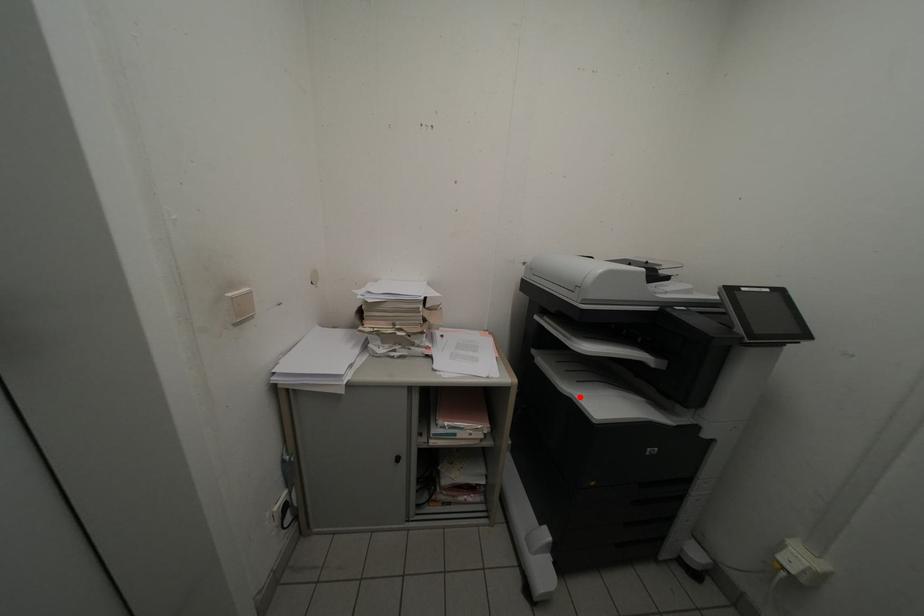
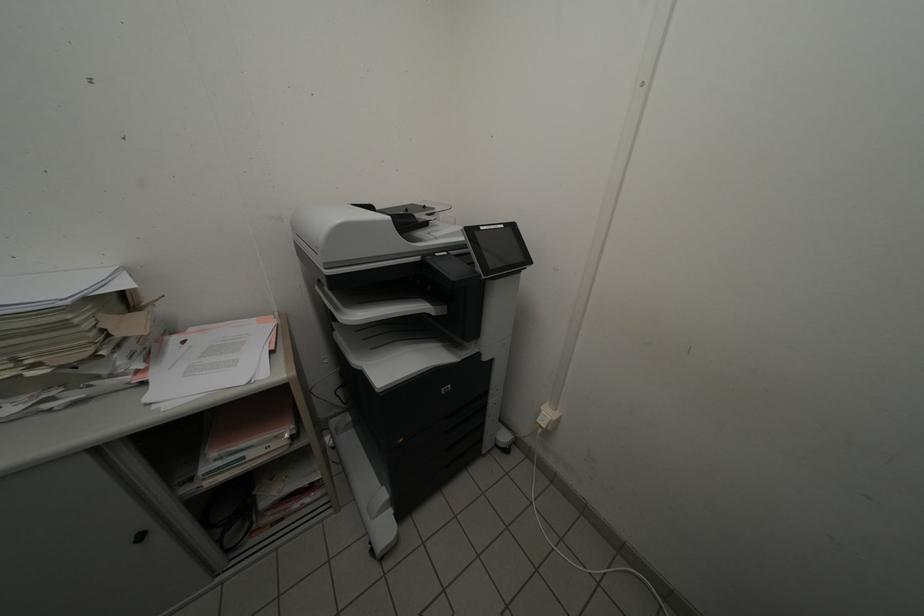
Question: I am providing you with two images of the same scene from different viewpoints. In image1, a red point is highlighted. Considering the same 3D point in image2, which of the following is correct?

Choices:
 (A) It is closer
 (B) It is farther

Answer: (A)